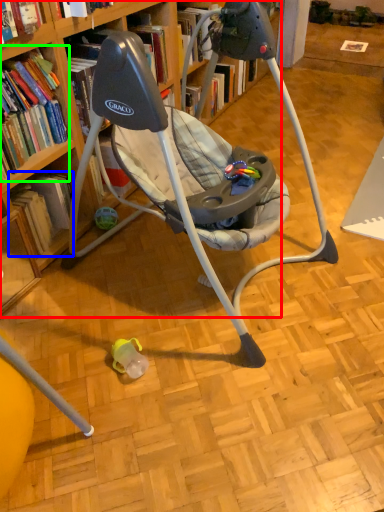
Question: Based on their relative distances, which object is farther from bookcase (highlighted by a red box)? Choose from book (highlighted by a blue box) and book (highlighted by a green box).

Choices:
 (A) book
 (B) book

Answer: (B)